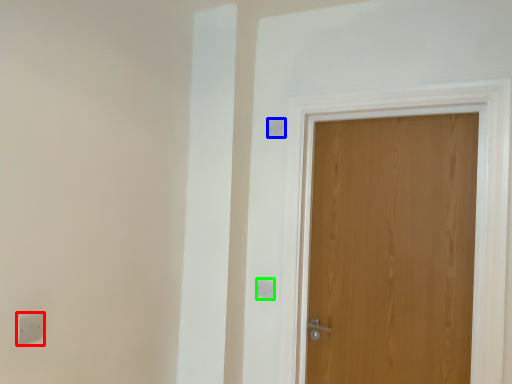
Question: Which object is the farthest from light switch (highlighted by a red box)? Choose among these: light switch (highlighted by a blue box) or light switch (highlighted by a green box).

Choices:
 (A) light switch
 (B) light switch

Answer: (A)